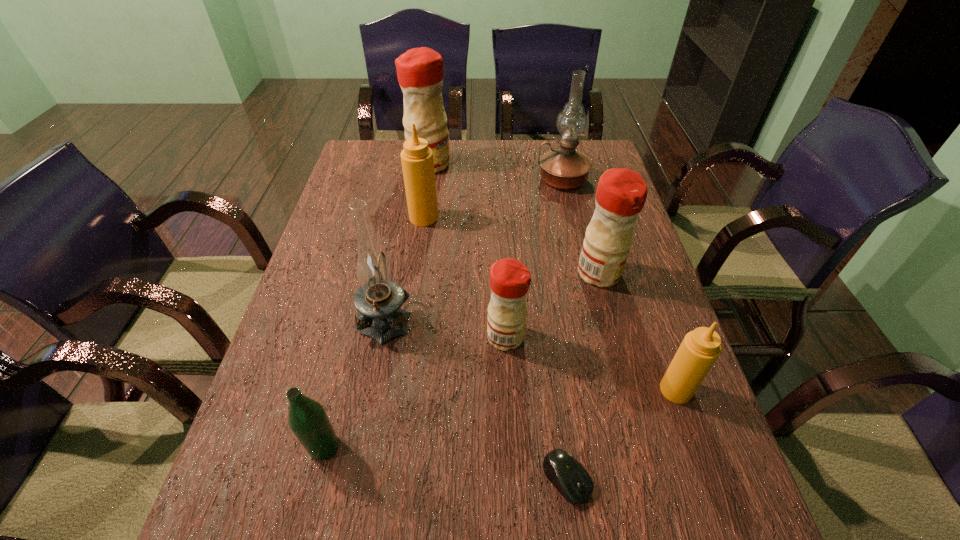
Where is `free point at the left edge`? free point at the left edge is located at coordinates (308, 496).

Where is `free space at the far right corner of the desktop`? This screenshot has height=540, width=960. free space at the far right corner of the desktop is located at coordinates (601, 141).

Where is `blank region between the rightmost condiment and the fourth farthest object`? The height and width of the screenshot is (540, 960). blank region between the rightmost condiment and the fourth farthest object is located at coordinates (637, 332).

Where is `empty location between the third farthest condiment and the seventh nearest object`? This screenshot has height=540, width=960. empty location between the third farthest condiment and the seventh nearest object is located at coordinates (512, 245).

Locate an element on the screen. This screenshot has height=540, width=960. vacant space that is in between the fifth object from left to right and the fourth farthest object is located at coordinates (552, 305).

You are a GUI agent. You are given a task and a screenshot of the screen. Output one action in this format:
    pyautogui.click(x=<x>, y=<y>)
    Task: Click on the vacant area that lies between the nearer oil lamp and the fourth farthest condiment
    
    Given the screenshot: What is the action you would take?
    pyautogui.click(x=446, y=327)

This screenshot has width=960, height=540. Identify the location of free space between the right oil lamp and the green bottle. (444, 313).

Where is `free space between the fourth farthest object and the rightmost object`? The image size is (960, 540). free space between the fourth farthest object and the rightmost object is located at coordinates (637, 332).

This screenshot has height=540, width=960. What are the coordinates of `free space between the bottle and the left oil lamp` in the screenshot? It's located at (355, 382).

Locate which object is the eighth closest to the farthest condiment. Please provide its 2D coordinates. Your answer should be formatted as a tuple, i.e. [(x, y)], where the tuple contains the x and y coordinates of a point satisfying the conditions above.

[(568, 476)]